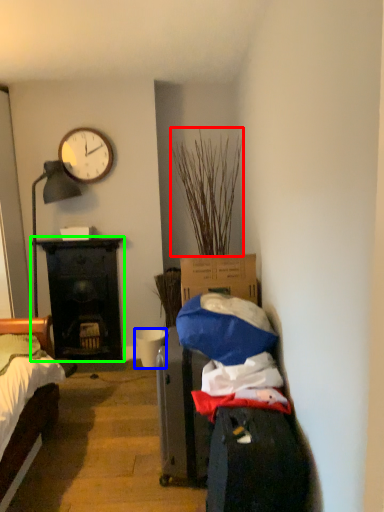
Question: Considering the real-world distances, which object is closest to plant (highlighted by a red box)? bucket (highlighted by a blue box) or desk (highlighted by a green box).

Choices:
 (A) bucket
 (B) desk

Answer: (B)